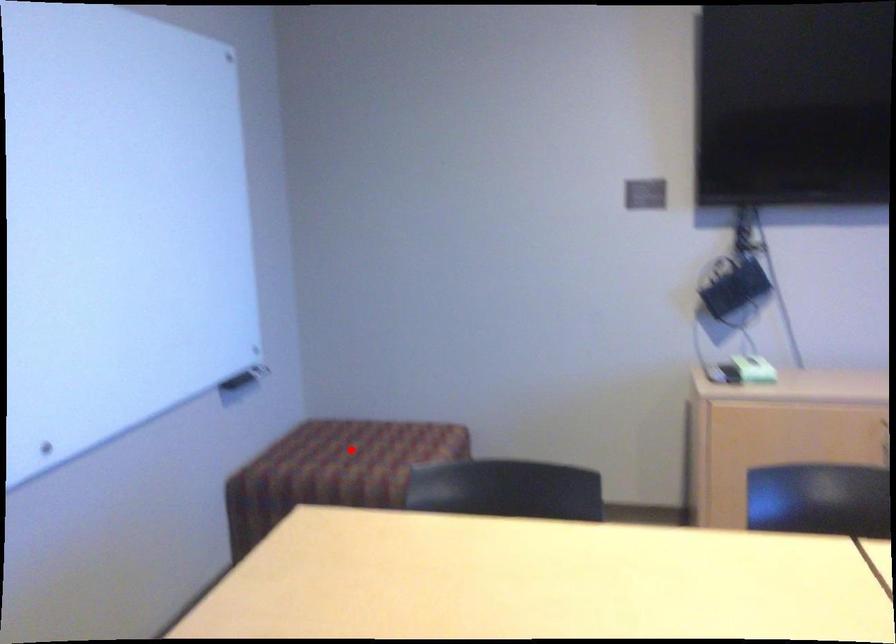
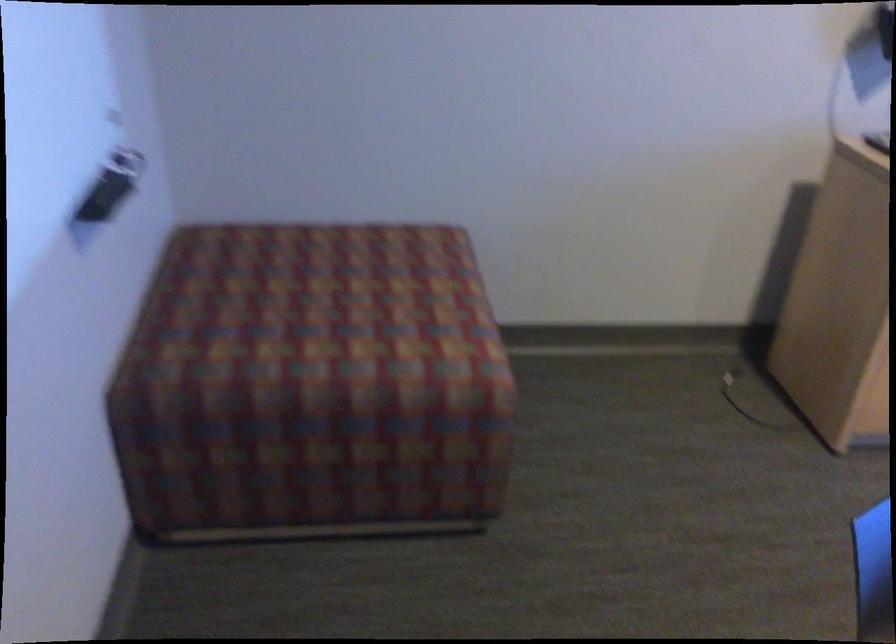
Question: I am providing you with two images of the same scene from different viewpoints. A red point is marked on the first image. Is the red point's position out of view in image 2?

Choices:
 (A) Yes
 (B) No

Answer: (B)